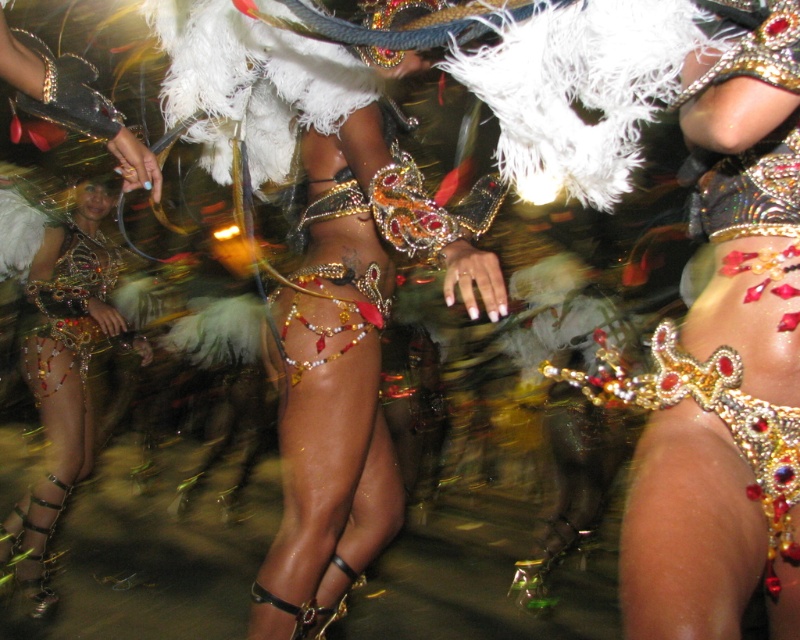
You are a photographer at the event and want to capture a photo of both the shiny gold bikini at center and the metallic gold bikini at center. Which one is positioned higher in the image?

The shiny gold bikini at center is positioned higher than the metallic gold bikini at center in the image.